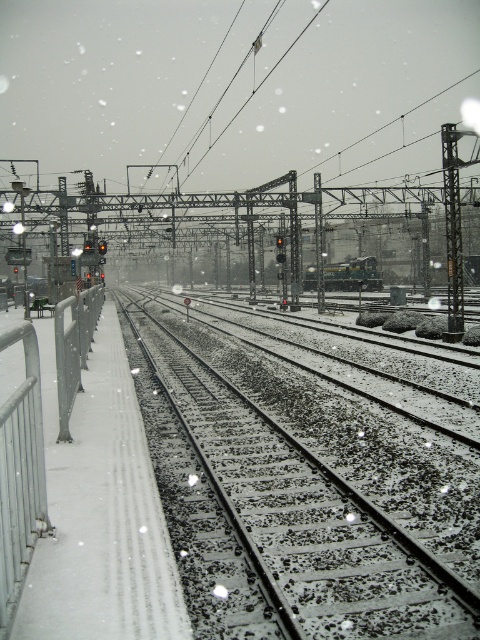
Does point (416, 556) come in front of point (381, 284)?

Yes, it is in front of point (381, 284).

Locate an element on the screen. snow-covered tracks at center is located at coordinates (294, 512).

This screenshot has height=640, width=480. Find the location of `snow-covered tracks at center`. snow-covered tracks at center is located at coordinates coord(294,512).